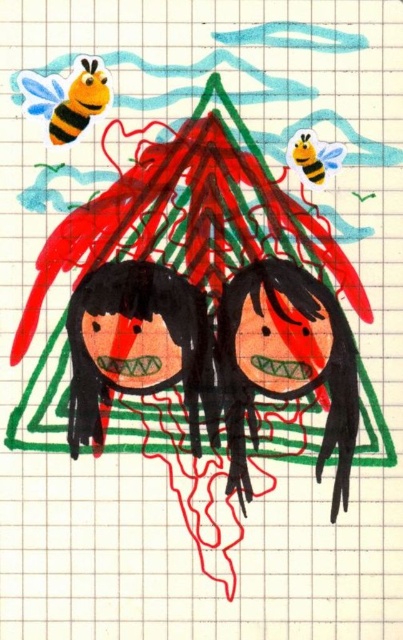
Who is more distant from viewer, (238, 307) or (108, 99)?

Positioned behind is point (238, 307).

Between black matte doll at center and yellow striped bee at upper left, which one has more height?

With more height is black matte doll at center.

The image size is (403, 640). What do you see at coordinates (286, 362) in the screenshot?
I see `black matte doll at center` at bounding box center [286, 362].

Where is `black matte doll at center`? The image size is (403, 640). black matte doll at center is located at coordinates pos(286,362).

Who is lower down, black matte doll at center or smooth black doll at center?

black matte doll at center

In the scene shown: Who is shorter, black matte doll at center or smooth black doll at center?

smooth black doll at center

The height and width of the screenshot is (640, 403). I want to click on black matte doll at center, so click(x=286, y=362).

Does smooth black doll at center have a larger size compared to yellow striped bee at upper left?

Correct, smooth black doll at center is larger in size than yellow striped bee at upper left.

Does smooth black doll at center have a smaller size compared to yellow striped bee at upper left?

No.

What are the coordinates of `smooth black doll at center` in the screenshot? It's located at (139, 346).

Identify the location of smooth black doll at center. (139, 346).